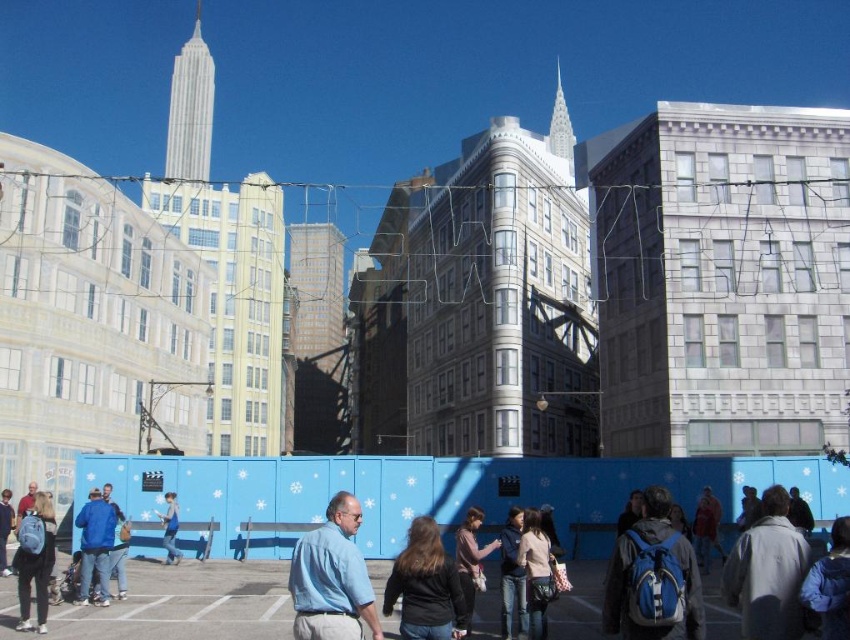
Between point (326, 540) and point (102, 579), which one is positioned behind?

The point (102, 579) is more distant.

You are a GUI agent. You are given a task and a screenshot of the screen. Output one action in this format:
    pyautogui.click(x=<x>, y=<y>)
    Task: Click on the light blue shirt at center
    This screenshot has height=640, width=850.
    Given the screenshot: What is the action you would take?
    pyautogui.click(x=332, y=579)

Between point (112, 540) and point (122, 531), which one is positioned behind?

The point (122, 531) is more distant.

Between blue denim jacket at lower left and blue denim jacket at center, which one appears on the right side from the viewer's perspective?

From the viewer's perspective, blue denim jacket at lower left appears more on the right side.

Which is in front, point (102, 604) or point (120, 516)?

Point (102, 604) is in front.

Locate an element on the screen. Image resolution: width=850 pixels, height=640 pixels. blue denim jacket at lower left is located at coordinates (95, 545).

Looking at this image, who is lower down, light blue shirt at center or blue denim jacket at center?

blue denim jacket at center is lower down.

Between light blue shirt at center and blue denim jacket at center, which one has less height?

With less height is blue denim jacket at center.

Where is `light blue shirt at center`? The image size is (850, 640). light blue shirt at center is located at coordinates (332, 579).